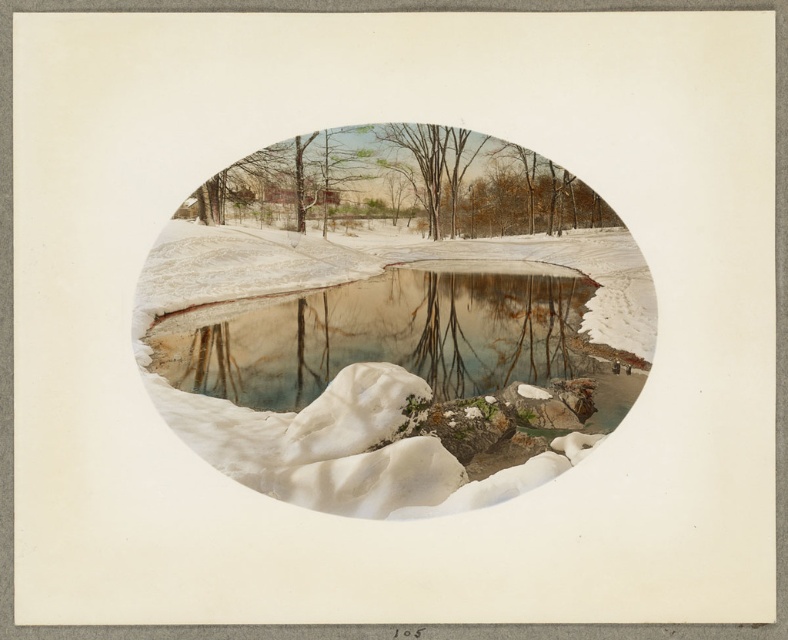
Who is lower down, white snow at center or smooth brown tree at center?

white snow at center

This screenshot has width=788, height=640. I want to click on white snow at center, so click(x=394, y=356).

Identify the location of white snow at center. This screenshot has height=640, width=788. (394, 356).

At what (x,y) coordinates should I click in order to perform the action: click on white snow at center. Please return your answer as a coordinate pair (x, y). The width and height of the screenshot is (788, 640). Looking at the image, I should click on point(394,356).

Between translucent ice water at center and brown matte tree at center, which one is positioned lower?

translucent ice water at center

Can you confirm if translucent ice water at center is wider than brown matte tree at center?

Correct, the width of translucent ice water at center exceeds that of brown matte tree at center.

Which is behind, point (433, 371) or point (474, 150)?

The point (433, 371) is more distant.

I want to click on translucent ice water at center, so click(x=387, y=337).

Can you confirm if smooth brown tree at center is positioned above brown matte tree at center?

No, smooth brown tree at center is not above brown matte tree at center.

Can you confirm if smooth brown tree at center is positioned below brown matte tree at center?

Correct, smooth brown tree at center is located below brown matte tree at center.

Is point (329, 195) positioned before point (422, 168)?

No.

The width and height of the screenshot is (788, 640). Identify the location of smooth brown tree at center. (403, 184).